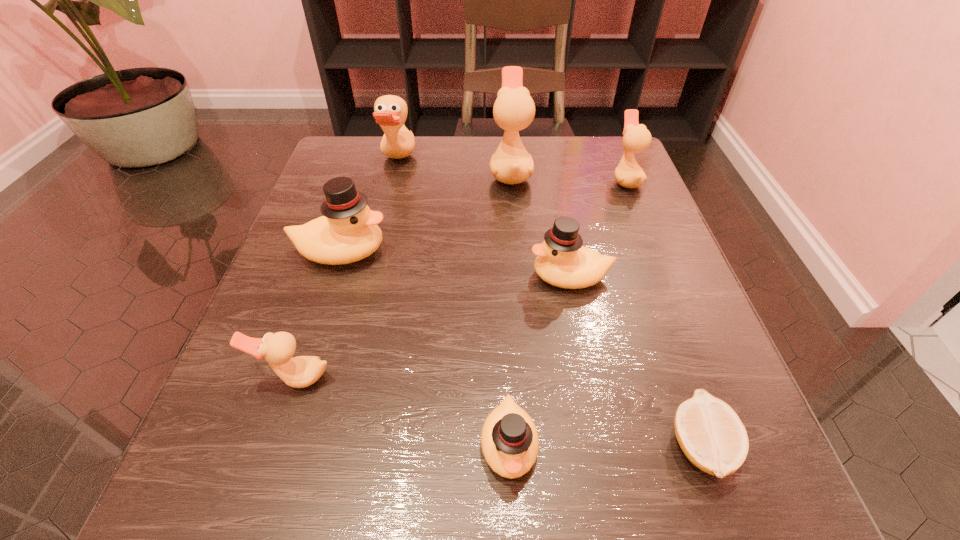
Locate an element on the screen. The image size is (960, 540). free spot between the shortest object and the rightmost tan duck is located at coordinates (662, 313).

Find the location of a particular element. This screenshot has width=960, height=540. free space between the biggest yellow duck and the smallest yellow duck is located at coordinates (425, 348).

Identify the location of free space between the tallest object and the third biggest tan duck. The image size is (960, 540). (568, 176).

This screenshot has height=540, width=960. In order to click on vacant space in between the tallest duck and the yellow lemon in this screenshot , I will do `click(605, 309)`.

I want to click on vacant area that lies between the rightmost duck and the tallest object, so (x=568, y=176).

You are a GUI agent. You are given a task and a screenshot of the screen. Output one action in this format:
    pyautogui.click(x=<x>, y=<y>)
    Task: Click on the vacant point located between the rightmost duck and the third tan duck from left to right
    Image resolution: width=960 pixels, height=540 pixels.
    Given the screenshot: What is the action you would take?
    pyautogui.click(x=568, y=176)

Locate an element on the screen. This screenshot has width=960, height=540. vacant area that lies between the shortest object and the leftmost yellow duck is located at coordinates (520, 348).

I want to click on blank region between the nearest duck and the rightmost duck, so click(567, 312).

The image size is (960, 540). I want to click on the closest object relative to the third smallest tan duck, so click(348, 232).

Identify which object is the sixth nearest to the third biggest tan duck. Please provide its 2D coordinates. Your answer should be formatted as a tuple, i.e. [(x, y)], where the tuple contains the x and y coordinates of a point satisfying the conditions above.

[(509, 439)]